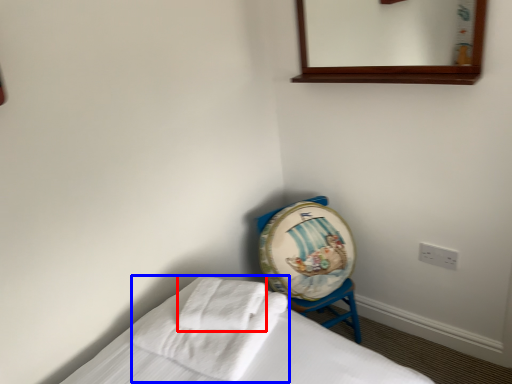
Question: Which point is closer to the camera, bath towel (highlighted by a red box) or bath towel (highlighted by a blue box)?

Choices:
 (A) bath towel
 (B) bath towel

Answer: (B)